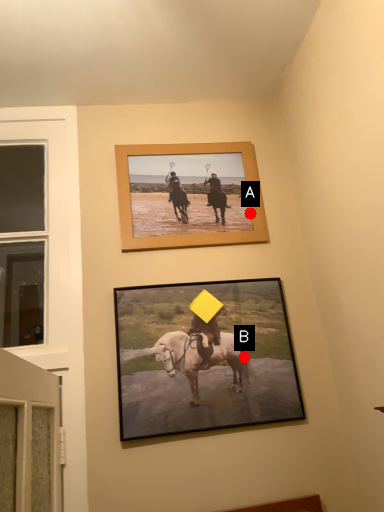
Question: Two points are circled on the image, labeled by A and B beside each circle. Which point is further to the camera?

Choices:
 (A) A is further
 (B) B is further

Answer: (A)